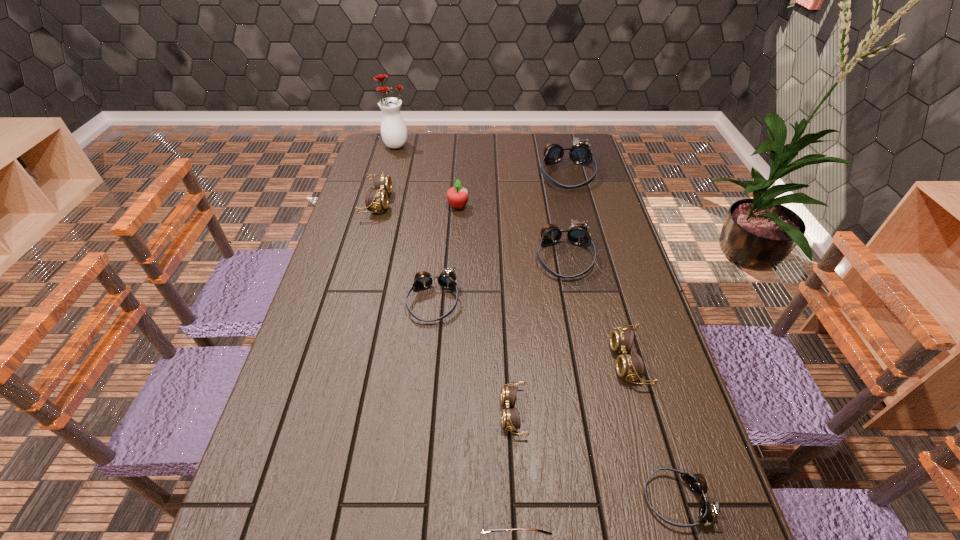
This screenshot has width=960, height=540. Identify the location of free space between the second goggles from left to right and the leftmost brown goggles. tap(405, 252).

Identify the location of free space between the apple and the third smallest bronze goggles. (511, 232).

This screenshot has height=540, width=960. In order to click on free space that is in between the leftmost brown goggles and the second biggest brown goggles in this screenshot , I will do `click(502, 282)`.

In order to click on free space between the second goggles from left to right and the biggest bronze goggles in this screenshot , I will do `click(499, 238)`.

This screenshot has width=960, height=540. What are the coordinates of `unoccupied area between the second smallest brown goggles and the tallest object` in the screenshot? It's located at (512, 253).

I want to click on the third closest object to the rightmost brown goggles, so click(x=510, y=419).

In order to click on object that stands as the second closest to the red apple in this screenshot , I will do `click(578, 235)`.

Point out which goggles is positioned as the sixth nearest to the second smallest bronze goggles. Please provide its 2D coordinates. Your answer should be formatted as a tuple, i.e. [(x, y)], where the tuple contains the x and y coordinates of a point satisfying the conditions above.

[(708, 511)]

Identify which goggles is the sixth closest to the nearest goggles. Please provide its 2D coordinates. Your answer should be formatted as a tuple, i.e. [(x, y)], where the tuple contains the x and y coordinates of a point satisfying the conditions above.

[(377, 199)]

Locate which bronze goggles ranks in proximity to the second smallest brown goggles. Please provide its 2D coordinates. Your answer should be formatted as a tuple, i.e. [(x, y)], where the tuple contains the x and y coordinates of a point satisfying the conditions above.

[(708, 511)]